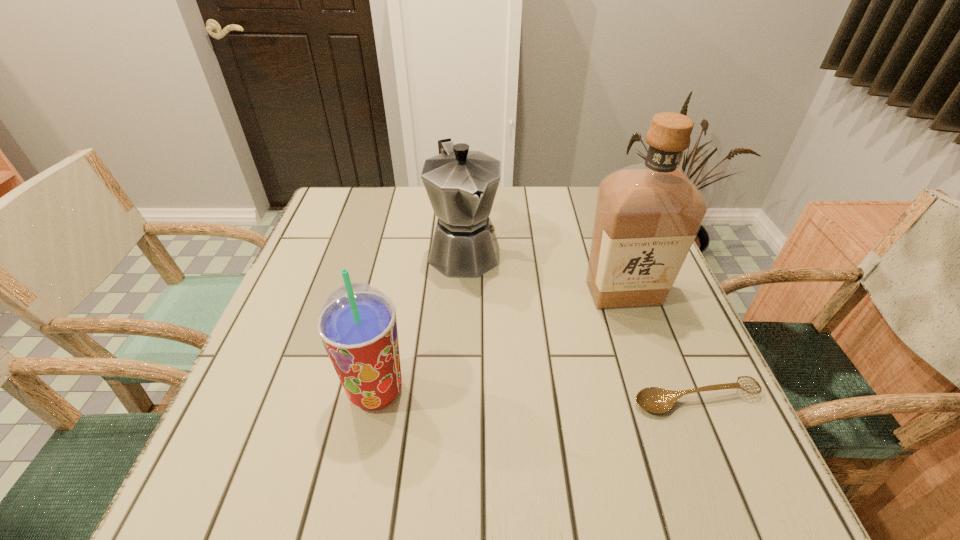
Locate an element on the screen. The image size is (960, 540). vacant region between the liquor and the ladle is located at coordinates (660, 346).

Identify the location of free space between the liquor and the coffeepot. This screenshot has height=540, width=960. (544, 272).

At what (x,y) coordinates should I click in order to perform the action: click on empty location between the tallest object and the shortest object. Please return your answer as a coordinate pair (x, y). This screenshot has height=540, width=960. Looking at the image, I should click on (660, 346).

The width and height of the screenshot is (960, 540). What are the coordinates of `object identified as the third closest to the liquor` in the screenshot? It's located at (357, 324).

Locate an element on the screen. This screenshot has width=960, height=540. the closest object to the smoothie is located at coordinates (461, 185).

The image size is (960, 540). What are the coordinates of `free location that satisfies the following two spatial constraints: 1. on the front side of the coffeepot; 2. on the left side of the shortest object` in the screenshot? It's located at (458, 399).

In order to click on free space in the image that satisfies the following two spatial constraints: 1. on the front side of the tallest object; 2. on the left side of the ladle in this screenshot , I will do `click(660, 399)`.